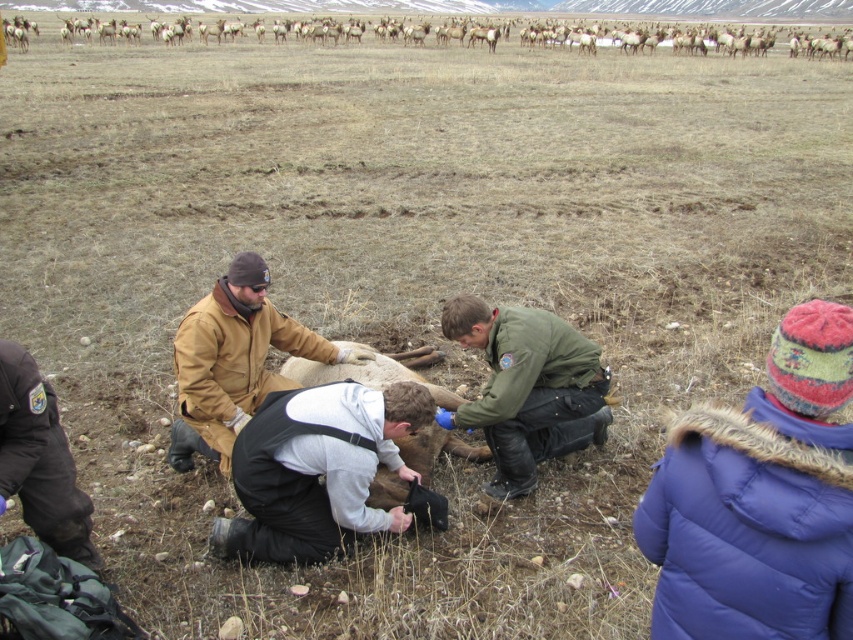
Question: Estimate the real-world distances between objects in this image. Which object is closer to the green uniform at center?

Choices:
 (A) dark brown uniform at lower left
 (B) brown fur at upper center
 (C) purple fuzzy coat at lower right
 (D) brown fur at center

Answer: (D)

Question: Which object is closer to the camera taking this photo?

Choices:
 (A) white fleece jacket at center
 (B) purple fuzzy coat at lower right

Answer: (B)

Question: Which point is closer to the camera taking this photo?

Choices:
 (A) (694, 544)
 (B) (20, 436)
 (C) (376, 353)
 (D) (670, 33)

Answer: (A)

Question: Does purple fuzzy coat at lower right appear over dark brown uniform at lower left?

Choices:
 (A) no
 (B) yes

Answer: (B)

Question: Is purple fuzzy coat at lower right positioned in front of brown fur at center?

Choices:
 (A) yes
 (B) no

Answer: (A)

Question: Is brown leather jacket at center thinner than brown fur at center?

Choices:
 (A) no
 (B) yes

Answer: (B)